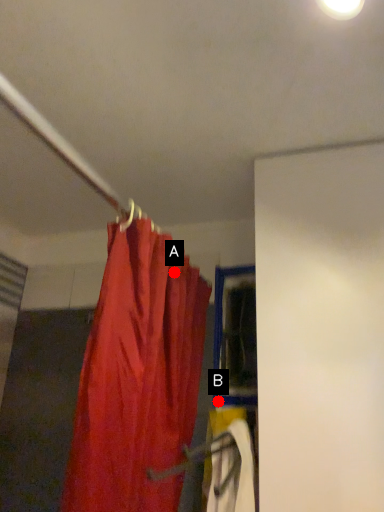
Question: Two points are circled on the image, labeled by A and B beside each circle. Which of the following is the closest to the observer?

Choices:
 (A) A is closer
 (B) B is closer

Answer: (A)